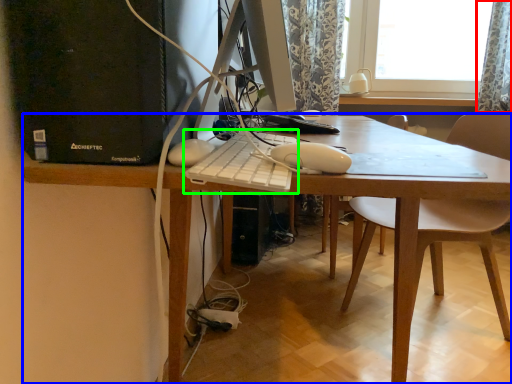
Question: Estimate the real-world distances between objects in this image. Which object is closer to curtain (highlighted by a red box), desk (highlighted by a blue box) or computer keyboard (highlighted by a green box)?

Choices:
 (A) desk
 (B) computer keyboard

Answer: (A)